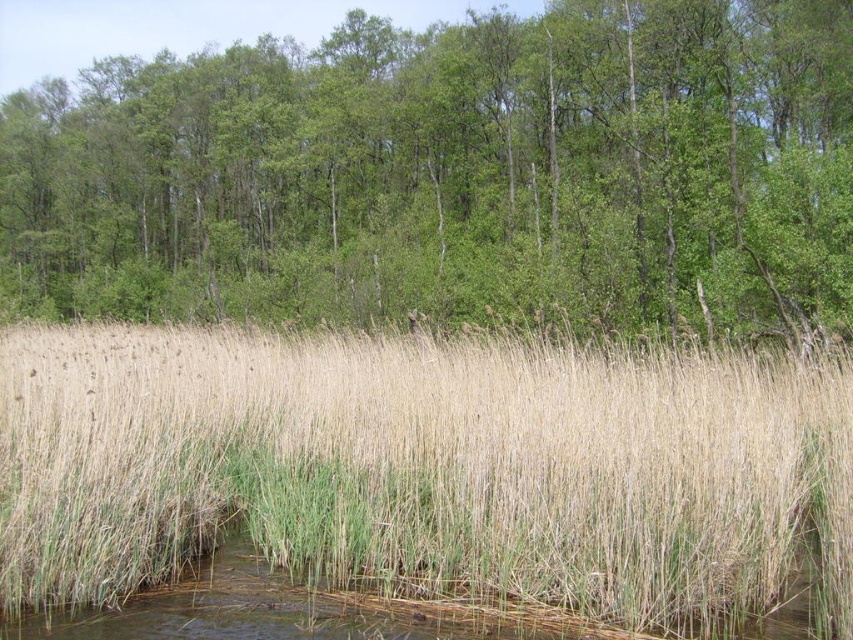
You are a hiker who needs to cross the stream to reach the green leafy trees at upper center from the dry grass at center. The stream is 10 feet wide. Can you safely cross the stream if you have a 15 feet long rope?

The distance between the green leafy trees at upper center and the dry grass at center is 69.51 feet. Since the stream is only 10 feet wide and you have a 15 feet long rope, you can safely cross the stream using the rope as it is longer than the stream width.

You are standing in the natural scene and want to move from the point at coordinates point (57, 198) to the point at coordinates point (264, 468). Which direction should you face to walk towards the second point?

Since point (57, 198) is closer to you than point (264, 468), you should face away from yourself towards the direction of the second point. However, based on the coordinates, point (264, 468) is located to the right and slightly behind you relative to point (57, 198). Therefore, you should turn to your right and walk backward to reach the second point.